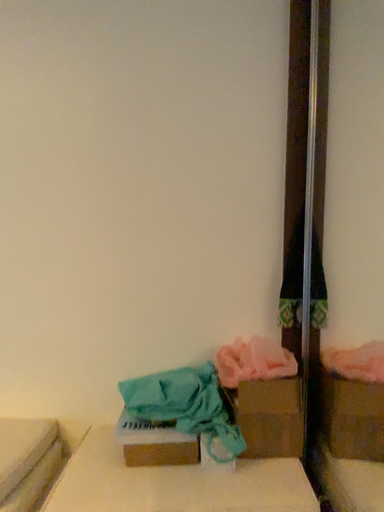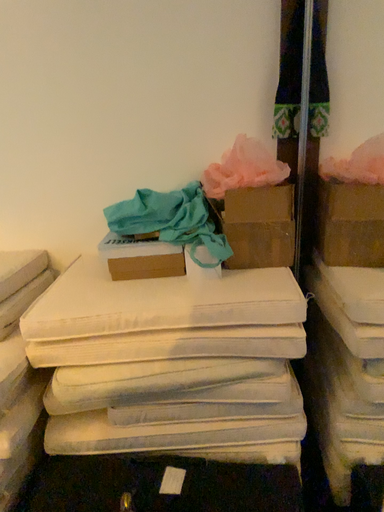
Question: Which way did the camera rotate in the video?

Choices:
 (A) rotated upward
 (B) rotated downward

Answer: (B)